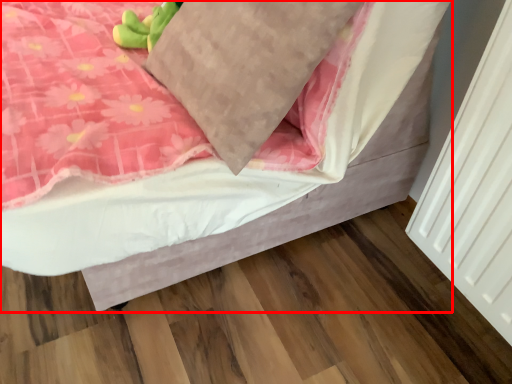
Question: Observing the image, what is the correct spatial positioning of bed (annotated by the red box) in reference to pillow?

Choices:
 (A) right
 (B) left

Answer: (B)